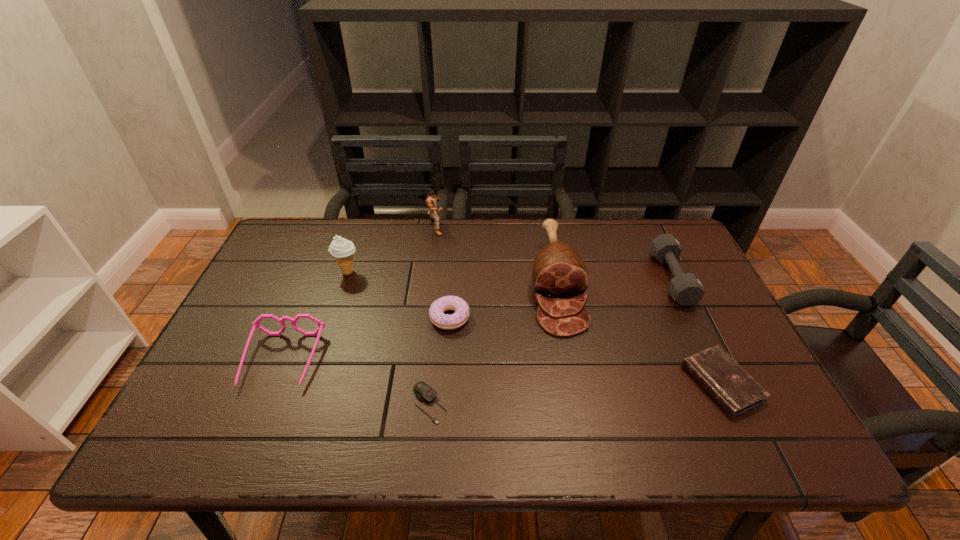
At what (x,y) coordinates should I click in order to perform the action: click on vacant region located on the left of the icecream. Please return your answer as a coordinate pair (x, y). Image resolution: width=960 pixels, height=540 pixels. Looking at the image, I should click on (272, 272).

Where is `free space located on the left of the dumbbell`? The width and height of the screenshot is (960, 540). free space located on the left of the dumbbell is located at coordinates (543, 278).

This screenshot has height=540, width=960. What are the coordinates of `free location located on the arms of the spectacles` in the screenshot? It's located at (255, 427).

Find the location of a particular element. This screenshot has height=540, width=960. blank space located 0.150m on the back of the doughnut is located at coordinates (453, 268).

Find the location of a particular element. The height and width of the screenshot is (540, 960). free location located 0.170m on the back of the second shortest object is located at coordinates (683, 303).

The width and height of the screenshot is (960, 540). In order to click on vacant region located on the left of the shortest object in this screenshot , I will do `click(291, 404)`.

Where is `puncher that is positioned at the far edge`? The height and width of the screenshot is (540, 960). puncher that is positioned at the far edge is located at coordinates (431, 200).

At what (x,y) coordinates should I click in order to perform the action: click on ham located at the far edge. Please return your answer as a coordinate pair (x, y). The height and width of the screenshot is (540, 960). Looking at the image, I should click on (559, 272).

The width and height of the screenshot is (960, 540). I want to click on icecream positioned at the far edge, so click(x=341, y=249).

The height and width of the screenshot is (540, 960). What are the coordinates of `dumbbell located in the far edge section of the desktop` in the screenshot? It's located at [686, 289].